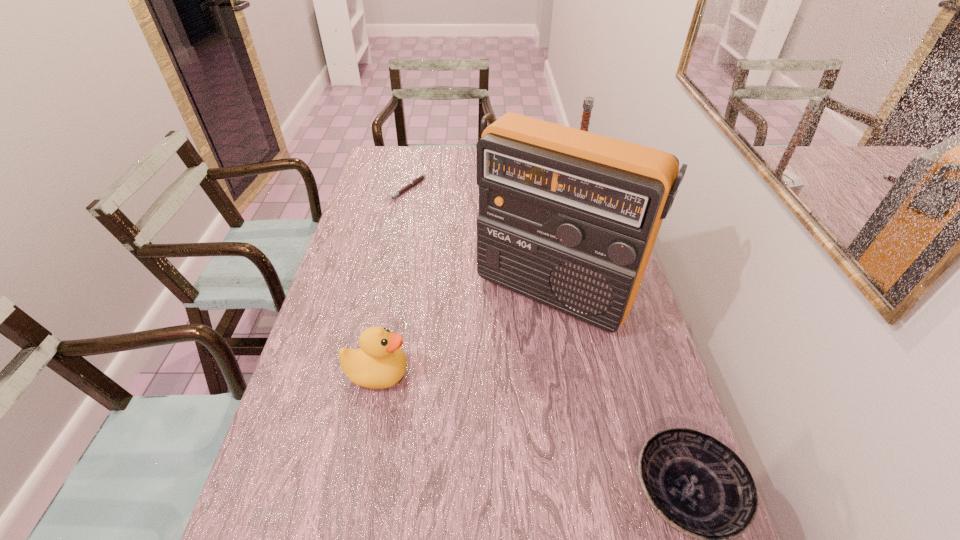
Image resolution: width=960 pixels, height=540 pixels. In the image, there is a desktop. Find the location of `vacant area at the left edge`. vacant area at the left edge is located at coordinates (378, 240).

This screenshot has width=960, height=540. In the image, there is a desktop. What are the coordinates of `vacant space at the far left corner` in the screenshot? It's located at tap(386, 158).

Image resolution: width=960 pixels, height=540 pixels. I want to click on vacant region between the duck and the radio receiver, so click(x=466, y=333).

You are a GUI agent. You are given a task and a screenshot of the screen. Output one action in this format:
    pyautogui.click(x=<x>, y=<y>)
    Task: Click on the vacant space in between the second tallest object and the second nearest object
    
    Given the screenshot: What is the action you would take?
    pyautogui.click(x=474, y=288)

Where is `vacant point located between the radio receiver and the duck`? vacant point located between the radio receiver and the duck is located at coordinates (x=466, y=333).

This screenshot has height=540, width=960. Find the location of `empty location between the shortest object and the third shortest object`. empty location between the shortest object and the third shortest object is located at coordinates (393, 281).

Select which object appears as the closest to the fourth tallest object. Please provide its 2D coordinates. Your answer should be formatted as a tuple, i.e. [(x, y)], where the tuple contains the x and y coordinates of a point satisfying the conditions above.

[(568, 218)]

Where is `object that stands as the third closest to the duck`? object that stands as the third closest to the duck is located at coordinates (419, 178).

Identify the location of blank space that satisfies the following two spatial constraints: 1. on the front side of the pen; 2. at the beak of the fourth farthest object. (369, 374).